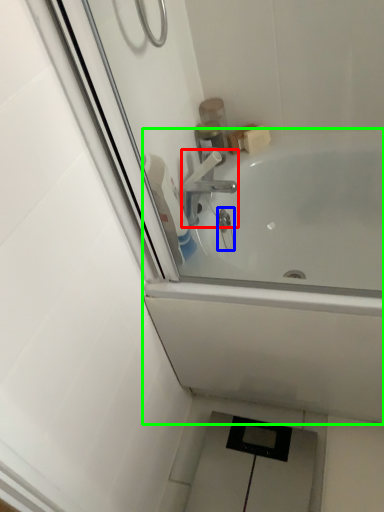
Question: Based on their relative distances, which object is farther from tap (highlighted by a red box)? Choose from plumbing fixture (highlighted by a blue box) and bathtub (highlighted by a green box).

Choices:
 (A) plumbing fixture
 (B) bathtub

Answer: (B)